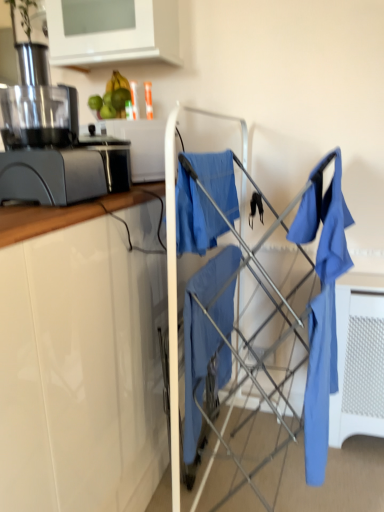
Question: Looking at the image, does white glossy cabinet at upper left seem bigger or smaller compared to matte blue shirt at right?

Choices:
 (A) small
 (B) big

Answer: (B)

Question: Is white glossy cabinet at upper left spatially inside matte blue shirt at right, or outside of it?

Choices:
 (A) inside
 (B) outside

Answer: (B)

Question: Which object is the closest to the matte gray juicer at left?

Choices:
 (A) white glossy cabinet at upper left
 (B) matte blue fabric at center
 (C) matte blue shirt at right
 (D) blue fabric at center
 (E) matte gray toaster at left

Answer: (E)

Question: Which of these objects is positioned farthest from the matte gray juicer at left?

Choices:
 (A) green matte avocado at upper center
 (B) matte blue shirt at right
 (C) matte blue fabric at center
 (D) white glossy cabinet at upper left
 (E) matte gray toaster at left

Answer: (D)